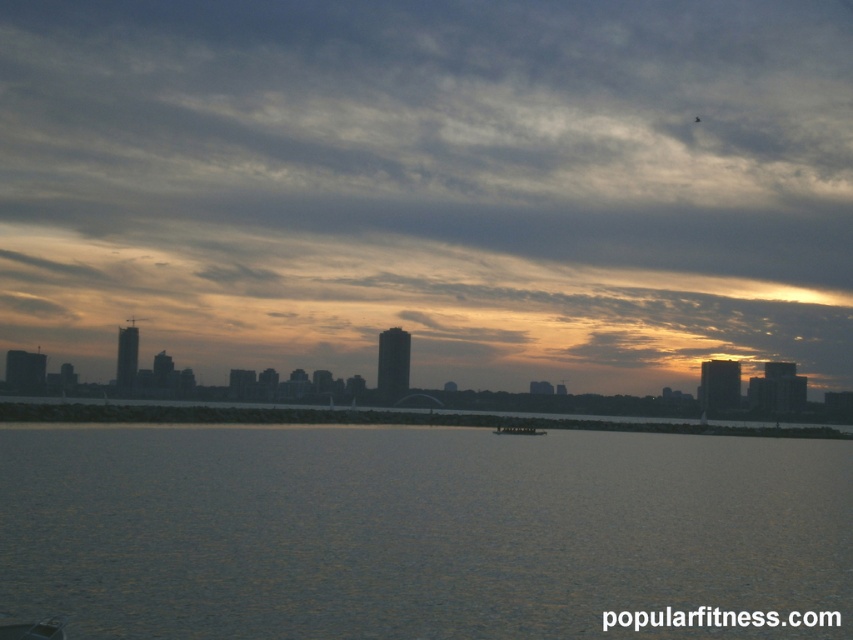
Where is `cloudy sky at center`? cloudy sky at center is located at coordinates (430, 186).

Is point (74, 262) positioned before point (517, 424)?

No, it is not.

This screenshot has height=640, width=853. Find the location of `cloudy sky at center`. cloudy sky at center is located at coordinates [430, 186].

Is silvery reflective water at center smaller than metallic silver boat at center?

Incorrect, silvery reflective water at center is not smaller in size than metallic silver boat at center.

Which is more to the left, silvery reflective water at center or metallic silver boat at center?

Positioned to the left is silvery reflective water at center.

Who is more distant from viewer, [328,593] or [505,435]?

Point [505,435]

The height and width of the screenshot is (640, 853). I want to click on silvery reflective water at center, so click(x=415, y=531).

Does cloudy sky at center lie in front of silvery reflective water at center?

No.

Who is more forward, (306, 147) or (78, 531)?

Point (78, 531) is in front.

Identify the location of cloudy sky at center. The height and width of the screenshot is (640, 853). (430, 186).